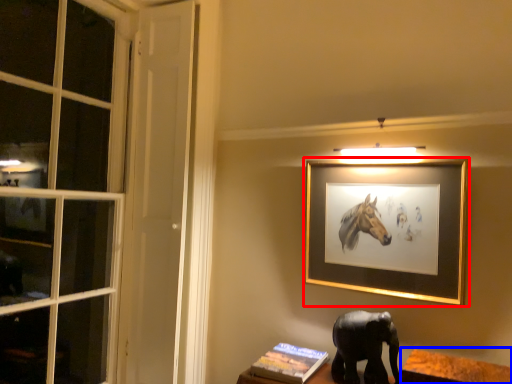
Question: Which object appears closest to the camera in this image, picture frame (highlighted by a red box) or table (highlighted by a blue box)?

Choices:
 (A) picture frame
 (B) table

Answer: (B)